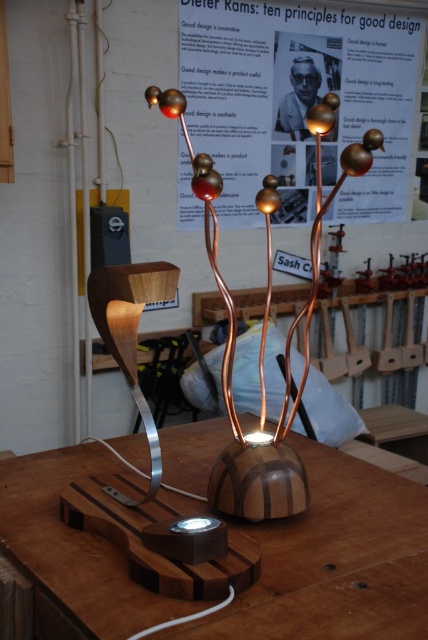
In the scene shown: Does metallic poster at upper center have a larger size compared to wooden table lamp at center?

Correct, metallic poster at upper center is larger in size than wooden table lamp at center.

Is metallic poster at upper center further to camera compared to wooden table lamp at center?

Yes, it is behind wooden table lamp at center.

Find the location of a particular element. metallic poster at upper center is located at coordinates (297, 102).

This screenshot has width=428, height=640. Find the location of `metallic poster at upper center`. metallic poster at upper center is located at coordinates (297, 102).

Does point (391, 541) come behind point (240, 500)?

No, (391, 541) is in front of (240, 500).

Does point (53, 564) lie behind point (207, 218)?

No, (53, 564) is in front of (207, 218).

Identify the location of wooden table at center. This screenshot has width=428, height=640. (335, 561).

How distant is wooden table at center from metallic poster at upper center?

wooden table at center and metallic poster at upper center are 1.55 meters apart.

Does wooden table at center appear over metallic poster at upper center?

No, wooden table at center is not above metallic poster at upper center.

The height and width of the screenshot is (640, 428). I want to click on wooden table at center, so click(335, 561).